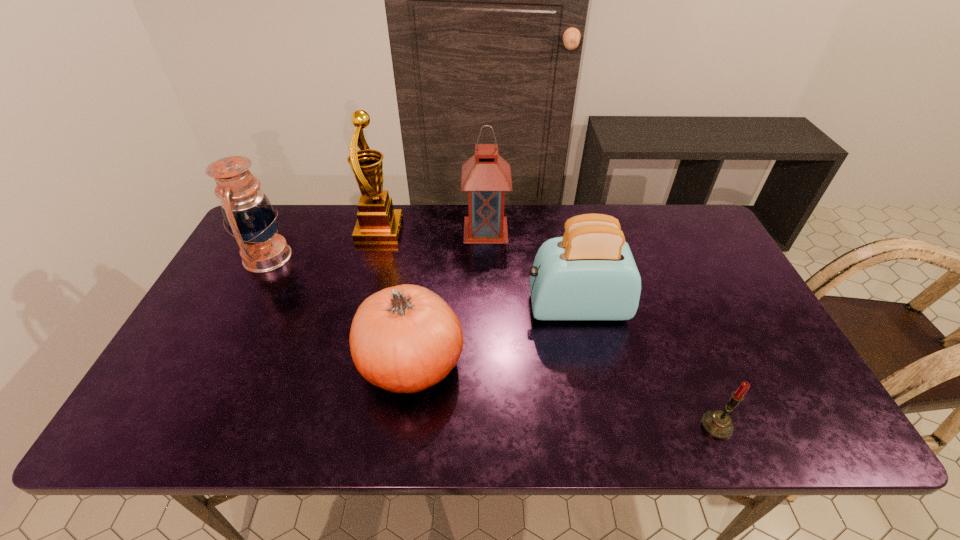
The width and height of the screenshot is (960, 540). In order to click on free region located 0.330m on the side of the toaster with the lever in this screenshot , I will do `click(404, 307)`.

Where is `free space located on the side of the toaster with the lever`? The width and height of the screenshot is (960, 540). free space located on the side of the toaster with the lever is located at coordinates (500, 307).

I want to click on vacant region located on the side of the toaster with the lever, so click(x=408, y=307).

Where is `vacant space situated on the back of the fifth tallest object`? This screenshot has height=540, width=960. vacant space situated on the back of the fifth tallest object is located at coordinates (427, 242).

At what (x,y) coordinates should I click in order to perform the action: click on free region located 0.210m on the left of the shortest object. Please return your answer as a coordinate pair (x, y). Looking at the image, I should click on (604, 426).

What are the coordinates of `award that is at the far edge` in the screenshot? It's located at (377, 222).

This screenshot has height=540, width=960. In order to click on lantern that is at the far edge in this screenshot , I will do `click(486, 176)`.

This screenshot has width=960, height=540. I want to click on oil lamp that is at the far edge, so click(x=248, y=213).

Locate an element on the screen. pumpkin situated at the near edge is located at coordinates (404, 339).

This screenshot has width=960, height=540. In order to click on candle at the near edge in this screenshot , I will do `click(718, 424)`.